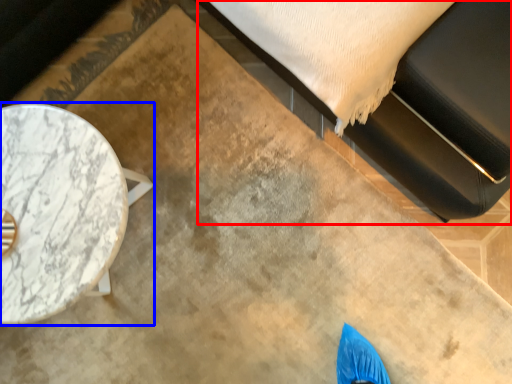
Question: Which of the following is the farthest to the observer, bed (highlighted by a red box) or table (highlighted by a blue box)?

Choices:
 (A) bed
 (B) table

Answer: (B)